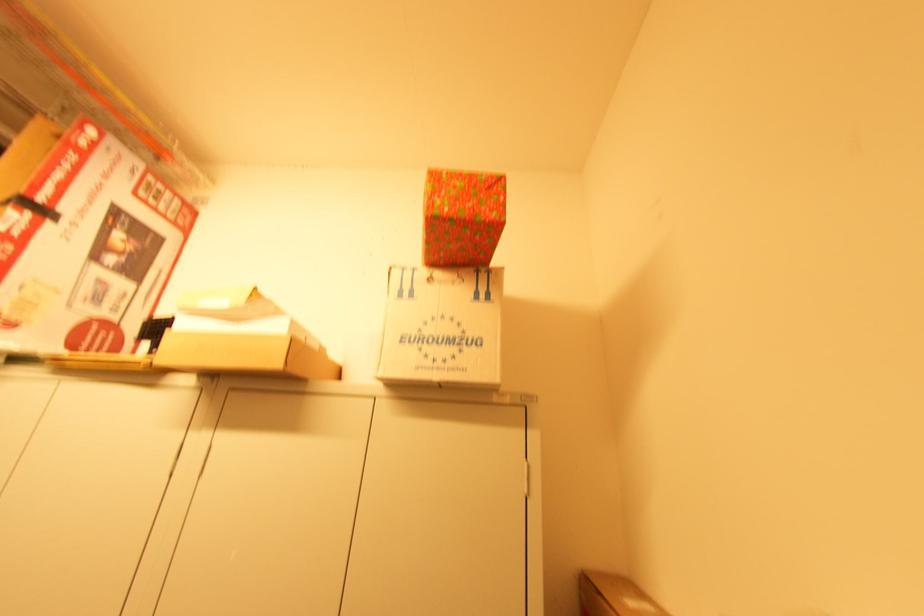
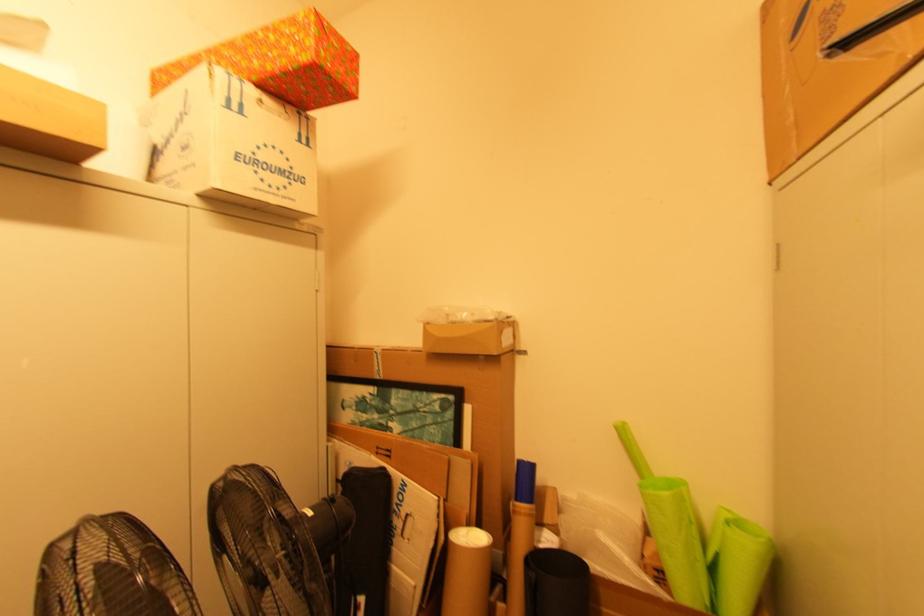
Locate, in the second image, the point that corresponds to (x=422, y=331) in the first image.

(257, 154)